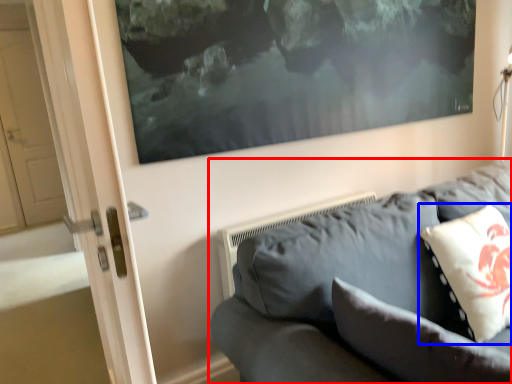
Question: Which object appears closest to the camera in this image, studio couch (highlighted by a red box) or pillow (highlighted by a blue box)?

Choices:
 (A) studio couch
 (B) pillow

Answer: (A)